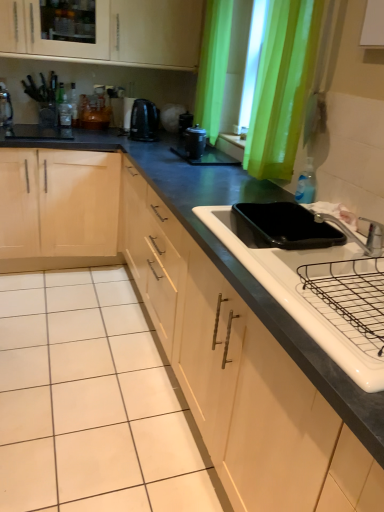
The width and height of the screenshot is (384, 512). Identify the location of free region on the left part of black matte pizza pan at sink. (207, 208).